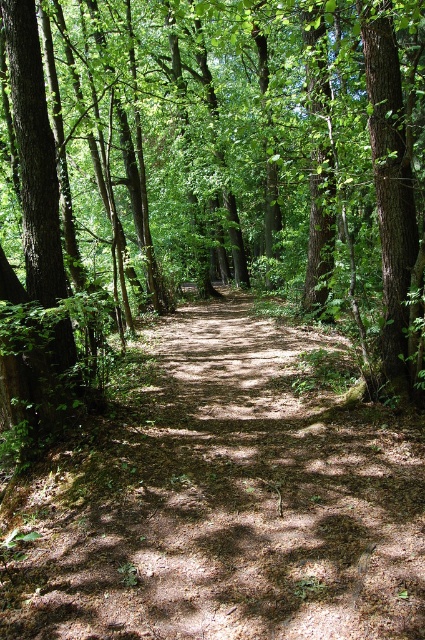
You are standing on the dirt path at center and want to take a photo of the brown textured tree at center. Which object is closer to you when you look through your camera lens?

The brown textured tree at center is closer to you than the dirt path at center because it is positioned further to the viewer.

You are a hiker standing at the start of the dirt path at center. You notice a brown textured tree at center ahead of you. Which direction should you walk to avoid the tree and continue along the path?

The brown textured tree at center is positioned over the dirt path at center, so you should walk around it either to the left or right to continue along the path.

You are standing on the forest path and see two points marked in the image. Which point is closer to you, point (96, 58) or point (363, 532)?

Point (96, 58) is closer to you because it is further to the viewer than point (363, 532).